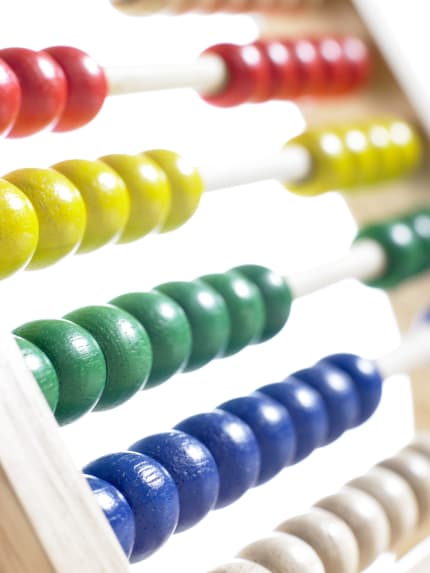
At what (x,y) coordinates should I click in order to perform the action: click on dowels. Please return your answer as a coordinate pair (x, y). The width and height of the screenshot is (430, 573). Looking at the image, I should click on (397, 358), (324, 276), (153, 72), (228, 170).